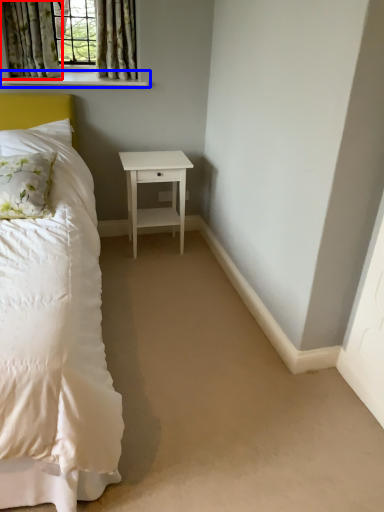
Question: Which point is closer to the camera, curtain (highlighted by a red box) or window sill (highlighted by a blue box)?

Choices:
 (A) curtain
 (B) window sill

Answer: (A)